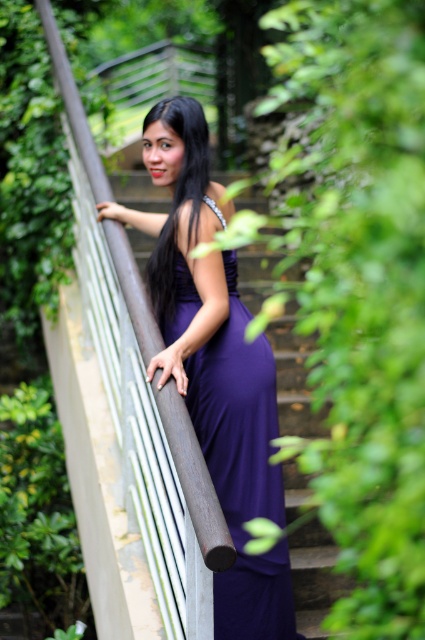
Question: Can you confirm if purple satin dress at center is wider than black silky hair at upper center?

Choices:
 (A) yes
 (B) no

Answer: (A)

Question: Is purple satin dress at center to the left of black silky hair at upper center from the viewer's perspective?

Choices:
 (A) no
 (B) yes

Answer: (A)

Question: Among these objects, which one is nearest to the camera?

Choices:
 (A) purple satin dress at center
 (B) black silky hair at upper center

Answer: (A)

Question: Can you confirm if purple satin dress at center is positioned above black silky hair at upper center?

Choices:
 (A) no
 (B) yes

Answer: (A)

Question: Among these points, which one is farthest from the camera?

Choices:
 (A) (164, 301)
 (B) (266, 476)

Answer: (A)

Question: Which point is closer to the camera taking this photo?

Choices:
 (A) (200, 140)
 (B) (255, 429)

Answer: (B)